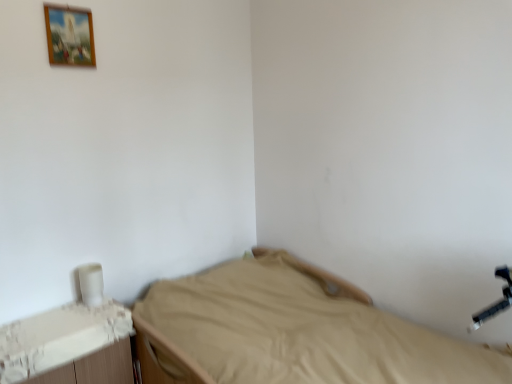
Question: Does beige fabric bed at center have a lesser width compared to wooden picture frame at upper left?

Choices:
 (A) yes
 (B) no

Answer: (B)

Question: Is the position of beige fabric bed at center more distant than that of wooden picture frame at upper left?

Choices:
 (A) no
 (B) yes

Answer: (A)

Question: Can you confirm if beige fabric bed at center is shorter than wooden picture frame at upper left?

Choices:
 (A) no
 (B) yes

Answer: (A)

Question: From the image's perspective, is beige fabric bed at center located beneath wooden picture frame at upper left?

Choices:
 (A) yes
 (B) no

Answer: (A)

Question: Considering the relative positions of beige fabric bed at center and wooden picture frame at upper left in the image provided, is beige fabric bed at center to the left of wooden picture frame at upper left from the viewer's perspective?

Choices:
 (A) no
 (B) yes

Answer: (A)

Question: Would you say white plastic changing table at lower left is to the left or to the right of beige fabric bed at center in the picture?

Choices:
 (A) left
 (B) right

Answer: (A)

Question: Is white plastic changing table at lower left spatially inside beige fabric bed at center, or outside of it?

Choices:
 (A) outside
 (B) inside

Answer: (A)

Question: Looking at their shapes, would you say white plastic changing table at lower left is wider or thinner than beige fabric bed at center?

Choices:
 (A) thin
 (B) wide

Answer: (A)

Question: From the image's perspective, is white plastic changing table at lower left above or below beige fabric bed at center?

Choices:
 (A) below
 (B) above

Answer: (A)

Question: Is wooden picture frame at upper left in front of or behind white plastic changing table at lower left in the image?

Choices:
 (A) front
 (B) behind

Answer: (B)

Question: Is wooden picture frame at upper left taller or shorter than white plastic changing table at lower left?

Choices:
 (A) short
 (B) tall

Answer: (A)

Question: Is point tap(91, 39) closer or farther from the camera than point tap(121, 327)?

Choices:
 (A) closer
 (B) farther

Answer: (B)

Question: From a real-world perspective, relative to white plastic changing table at lower left, is wooden picture frame at upper left vertically above or below?

Choices:
 (A) below
 (B) above

Answer: (B)

Question: Relative to beige fabric bed at center, is wooden picture frame at upper left in front or behind?

Choices:
 (A) front
 (B) behind

Answer: (B)

Question: Choose the correct answer: Is wooden picture frame at upper left inside beige fabric bed at center or outside it?

Choices:
 (A) inside
 (B) outside

Answer: (B)